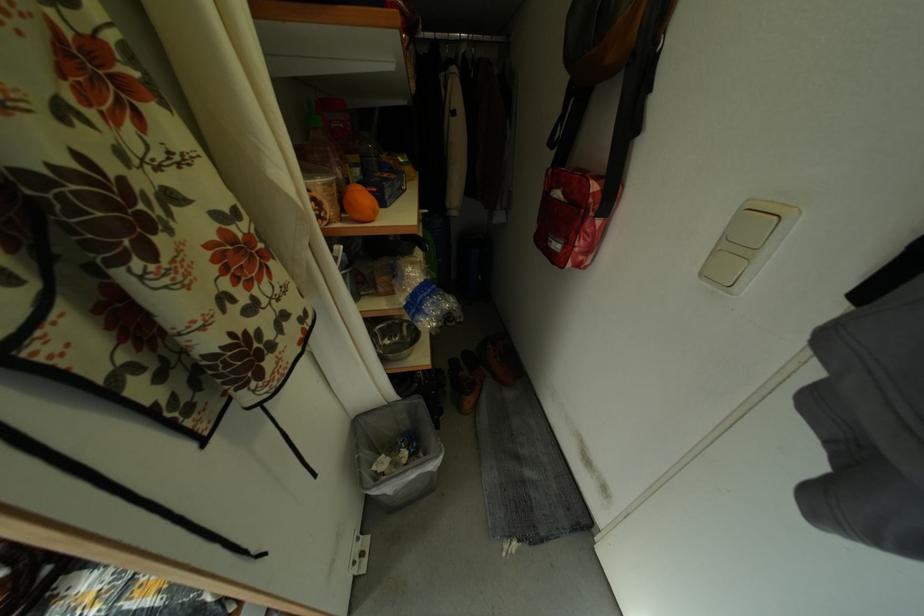
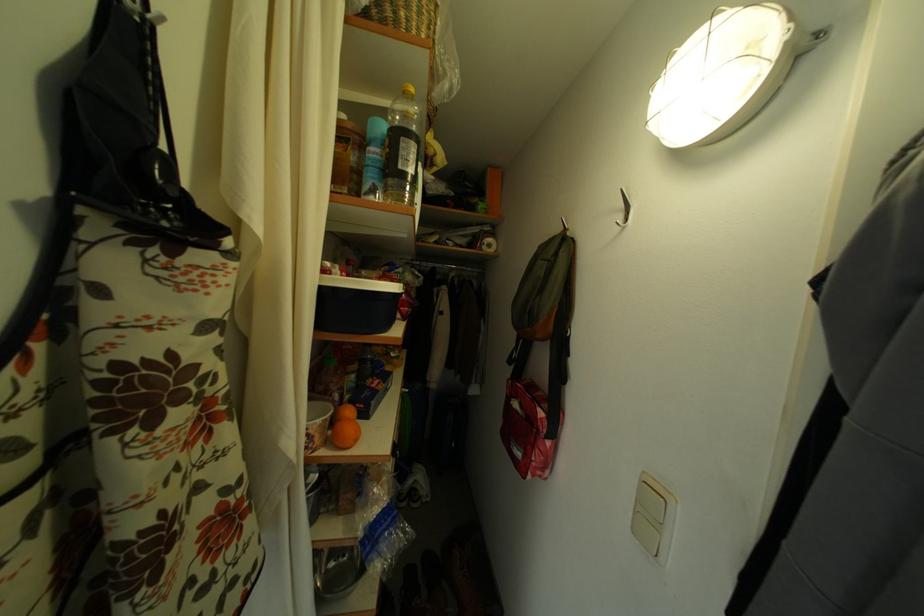
Question: Based on the continuous images, in which direction is the camera rotating? Reply with the corresponding letter.

Choices:
 (A) Left
 (B) Right
 (C) Up
 (D) Down

Answer: (C)